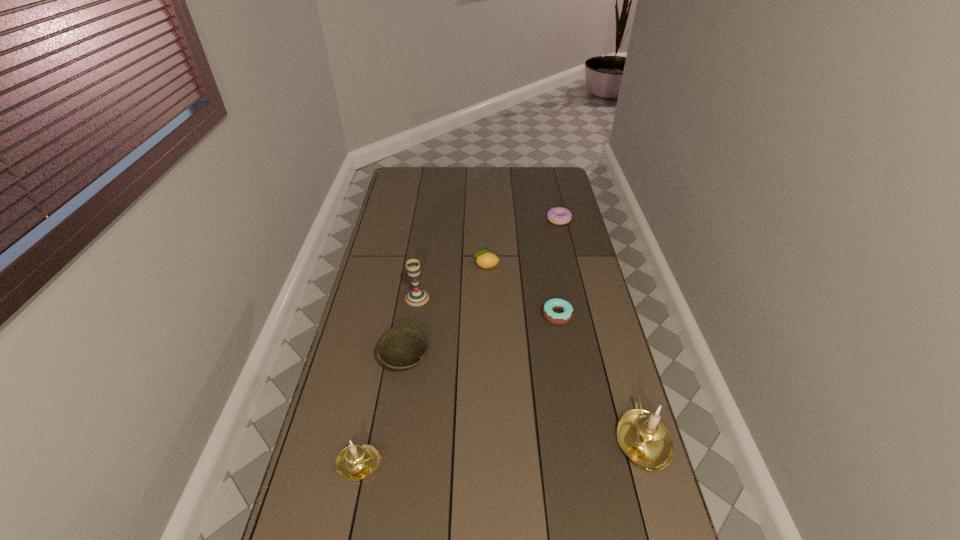
Where is `vacant spot for a new candle_holder to ensure equal spacing`? Image resolution: width=960 pixels, height=540 pixels. vacant spot for a new candle_holder to ensure equal spacing is located at coordinates coord(505,450).